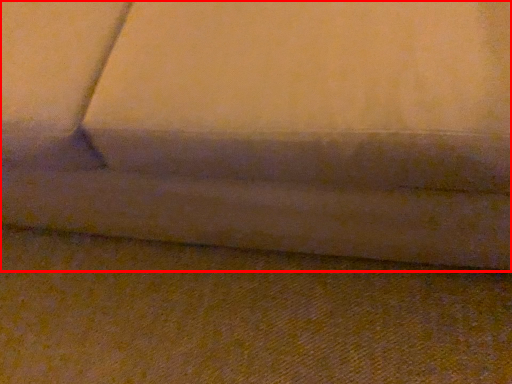
Question: Considering the relative positions of studio couch (annotated by the red box) and surface in the image provided, where is studio couch (annotated by the red box) located with respect to the staircase?

Choices:
 (A) right
 (B) left

Answer: (B)